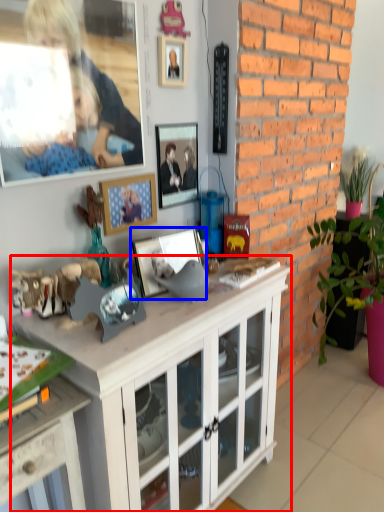
Question: Which point is closer to the camera, cabinetry (highlighted by a red box) or picture frame (highlighted by a blue box)?

Choices:
 (A) cabinetry
 (B) picture frame

Answer: (A)